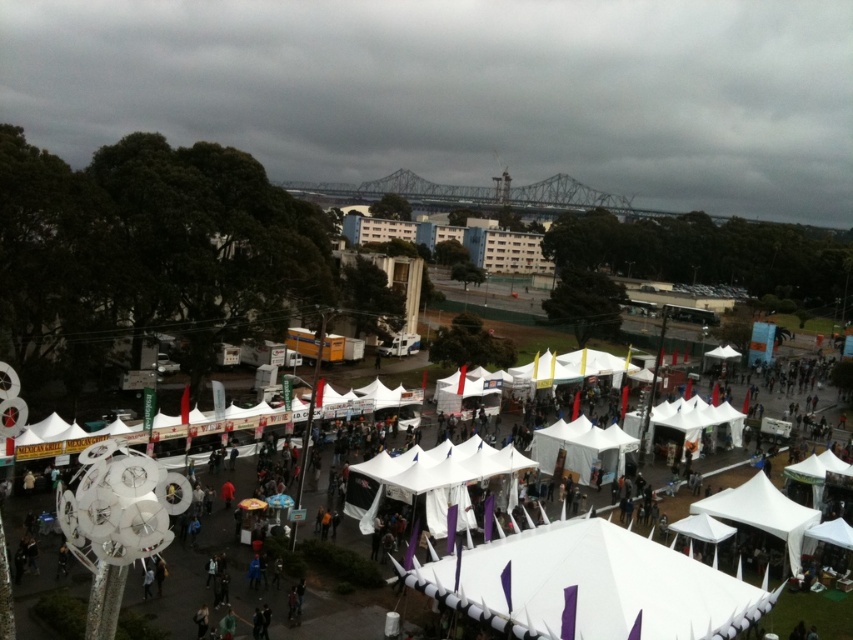
You are organizing a small gathering and need to decide between the white fabric canopy at center and the white fabric tent at lower right. Which one offers more space for attendees to gather under?

The white fabric canopy at center is larger in size than the white fabric tent at lower right, so it offers more space for attendees to gather under.

You are standing at the entrance of the event and see both the white fabric canopy at center and the white fabric tent at lower right. Which one is positioned lower in the image?

The white fabric canopy at center is positioned below the white fabric tent at lower right, so the white fabric canopy at center is lower in the image.

Based on the photo, you are standing at the entrance of the outdoor event and see two points marked in the image. The first point is at coordinate point(653,580) and the second is at point(717,516). Which point is closer to you?

Point(653,580) is closer to the viewer than point(717,516).